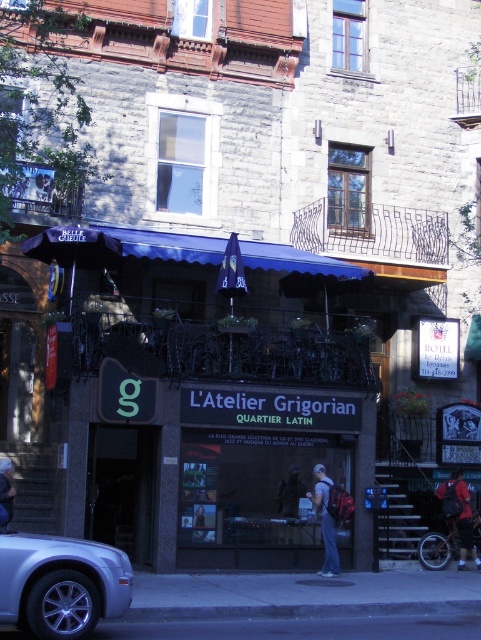
Does denim pants at center have a greater height compared to denim jacket at lower right?

Correct, denim pants at center is much taller as denim jacket at lower right.

Does point (328, 545) come closer to viewer compared to point (10, 520)?

No, it is not.

The height and width of the screenshot is (640, 481). In order to click on denim pants at center in this screenshot , I will do `click(326, 522)`.

Which is more to the right, red backpack at lower right or denim jacket at lower right?

From the viewer's perspective, red backpack at lower right appears more on the right side.

Does red backpack at lower right come in front of denim jacket at lower right?

No, red backpack at lower right is behind denim jacket at lower right.

Is point (448, 516) in front of point (2, 490)?

No, it is behind (2, 490).

You are a GUI agent. You are given a task and a screenshot of the screen. Output one action in this format:
    pyautogui.click(x=<x>, y=<y>)
    Task: Click on the red backpack at lower right
    This screenshot has width=481, height=640.
    Given the screenshot: What is the action you would take?
    (x=458, y=515)

Which is more to the left, red backpack at lower right or dark blue jacket at center?

dark blue jacket at center

Does red backpack at lower right have a greater height compared to dark blue jacket at center?

Correct, red backpack at lower right is much taller as dark blue jacket at center.

Between point (457, 568) and point (291, 513), which one is positioned in front?

Positioned in front is point (291, 513).

You are a GUI agent. You are given a task and a screenshot of the screen. Output one action in this format:
    pyautogui.click(x=<x>, y=<y>)
    Task: Click on the red backpack at lower right
    
    Given the screenshot: What is the action you would take?
    pyautogui.click(x=458, y=515)